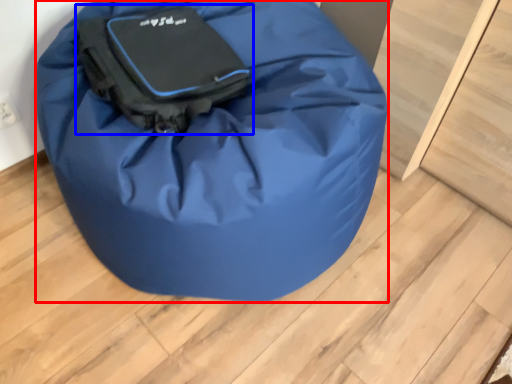
Question: Which of the following is the farthest to the observer, luggage and bags (highlighted by a red box) or luggage and bags (highlighted by a blue box)?

Choices:
 (A) luggage and bags
 (B) luggage and bags

Answer: (B)